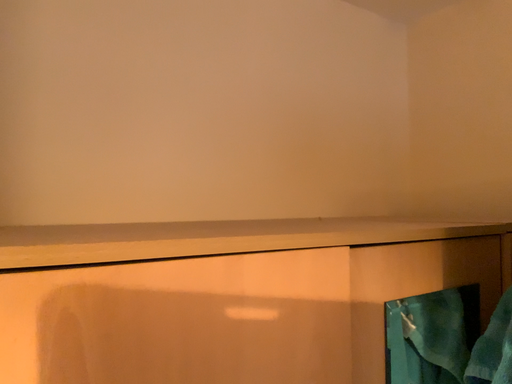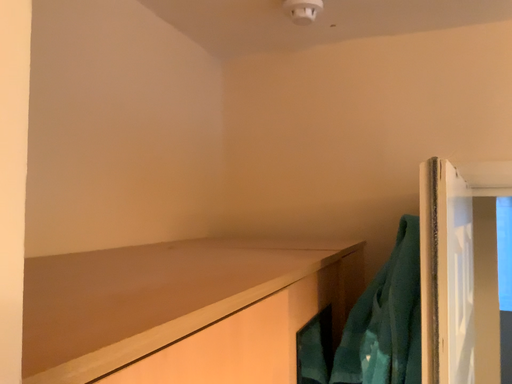
Question: Which way did the camera rotate in the video?

Choices:
 (A) rotated right
 (B) rotated left

Answer: (A)